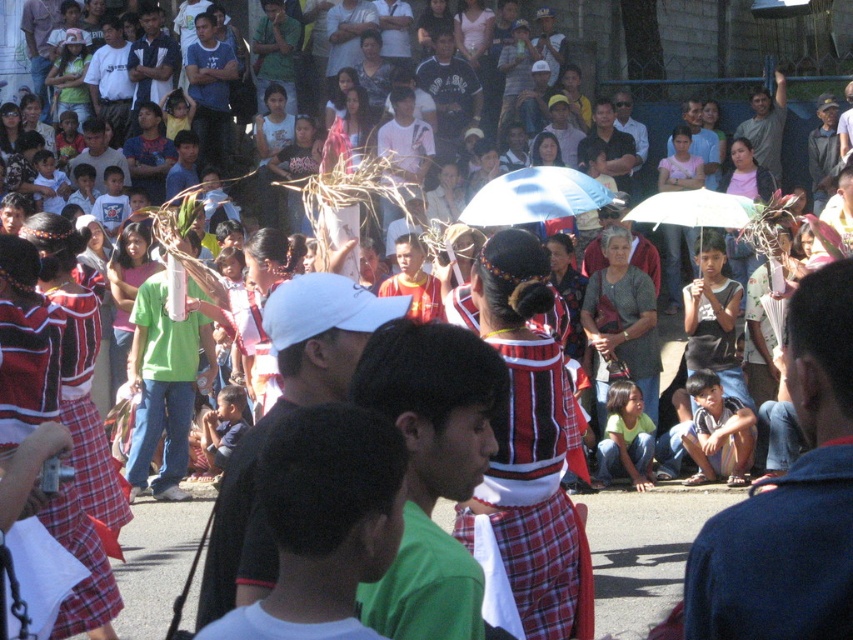
You are a photographer trying to capture a clear shot of the white cap at center and the blue fabric umbrella at center. Since you want both to be visible, which object should you focus on first to ensure it doesn t get obscured?

You should focus on the white cap at center first because it has a larger size compared to the blue fabric umbrella at center, making it more likely to block the view of the smaller umbrella if not positioned correctly.

You are a photographer standing at the edge of the event area. You want to capture a photo that includes both the denim jacket at lower right and the green fabric shirt at center. Given that your camera has a maximum focus range of 2.5 meters, will you be able to include both subjects in the same frame without moving closer?

The denim jacket at lower right and green fabric shirt at center are 2.62 meters apart from each other. Since the distance between them exceeds the camera maximum focus range of 2.5 meters, you will not be able to include both subjects in the same frame without moving closer.

You are standing at the center of the scene and want to locate the green fabric shirt at center. According to the coordinates provided, in which direction should you look to find it?

The green fabric shirt at center is located at coordinates point [431,472], so you should look to the right and slightly downward from the center point to find it.